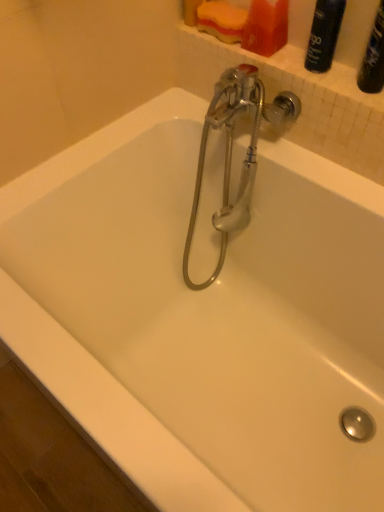
Question: Is chrome metallic faucet at center positioned behind matte black spray can at upper right?

Choices:
 (A) no
 (B) yes

Answer: (B)

Question: From a real-world perspective, is chrome metallic faucet at center located higher than matte black spray can at upper right?

Choices:
 (A) no
 (B) yes

Answer: (A)

Question: Is chrome metallic faucet at center smaller than matte black spray can at upper right?

Choices:
 (A) yes
 (B) no

Answer: (B)

Question: From a real-world perspective, is chrome metallic faucet at center under matte black spray can at upper right?

Choices:
 (A) yes
 (B) no

Answer: (A)

Question: Is matte black spray can at upper right surrounded by chrome metallic faucet at center?

Choices:
 (A) no
 (B) yes

Answer: (A)

Question: Can you confirm if chrome metallic faucet at center is taller than matte black spray can at upper right?

Choices:
 (A) yes
 (B) no

Answer: (A)

Question: Does matte plastic soap at upper center have a greater width compared to matte black spray can at upper right?

Choices:
 (A) yes
 (B) no

Answer: (A)

Question: From the image's perspective, is matte plastic soap at upper center under matte black spray can at upper right?

Choices:
 (A) yes
 (B) no

Answer: (B)

Question: From a real-world perspective, is matte plastic soap at upper center on matte black spray can at upper right?

Choices:
 (A) yes
 (B) no

Answer: (B)

Question: Are matte plastic soap at upper center and matte black spray can at upper right beside each other?

Choices:
 (A) yes
 (B) no

Answer: (B)

Question: Are matte plastic soap at upper center and matte black spray can at upper right far apart?

Choices:
 (A) no
 (B) yes

Answer: (A)

Question: Does matte plastic soap at upper center appear on the left side of matte black spray can at upper right?

Choices:
 (A) yes
 (B) no

Answer: (A)

Question: Does chrome metallic faucet at center have a larger size compared to matte plastic soap at upper center?

Choices:
 (A) yes
 (B) no

Answer: (A)